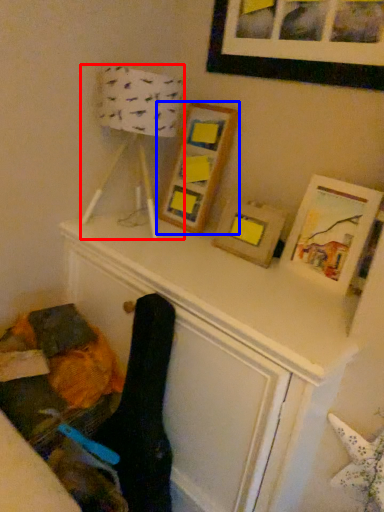
Question: Which point is further to the camera, table lamp (highlighted by a red box) or picture frame (highlighted by a blue box)?

Choices:
 (A) table lamp
 (B) picture frame

Answer: (B)